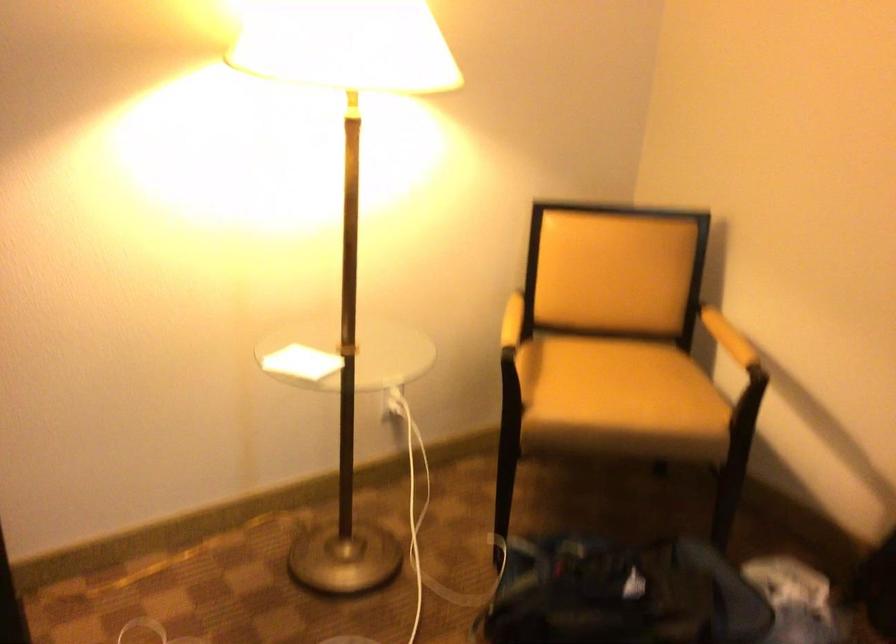
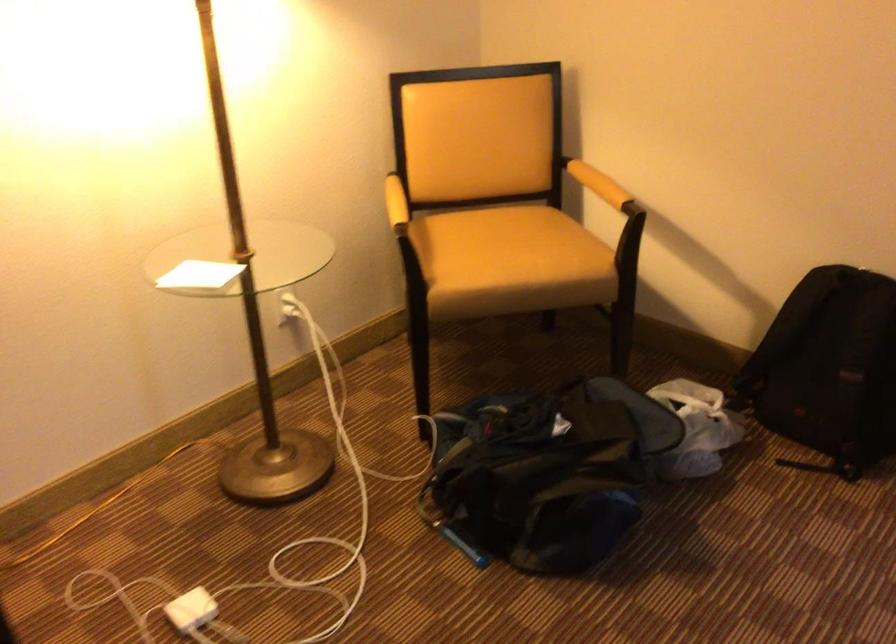
Locate, in the second image, the point that corresponds to (x=296, y=362) in the first image.

(199, 275)